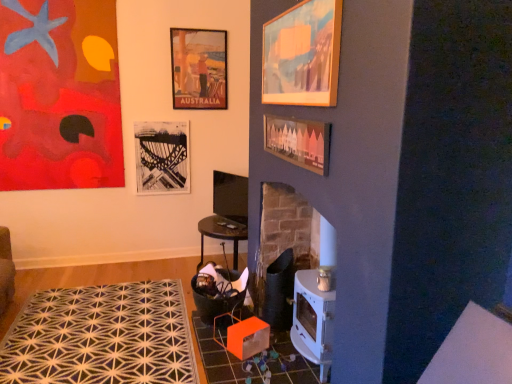
Question: Can you confirm if abstract painting at upper left, the 1th picture frame from the left, is bigger than wooden picture frame at center, the 2th picture frame viewed from the right?

Choices:
 (A) yes
 (B) no

Answer: (A)

Question: Is abstract painting at upper left, which appears as the 5th picture frame when viewed from the right, thinner than wooden picture frame at center, the 2th picture frame viewed from the right?

Choices:
 (A) yes
 (B) no

Answer: (B)

Question: Is abstract painting at upper left, which ranks as the 3th picture frame in back-to-front order, located outside wooden picture frame at center, positioned as the second picture frame in front-to-back order?

Choices:
 (A) no
 (B) yes

Answer: (B)

Question: Is abstract painting at upper left, which appears as the 5th picture frame when viewed from the right, closer to the viewer compared to wooden picture frame at center, the fourth picture frame viewed from the back?

Choices:
 (A) no
 (B) yes

Answer: (A)

Question: Is abstract painting at upper left, which ranks as the 3th picture frame in back-to-front order, directly adjacent to wooden picture frame at center, positioned as the second picture frame in front-to-back order?

Choices:
 (A) yes
 (B) no

Answer: (B)

Question: Is orange fabric rocking chair at lower left inside the boundaries of wooden picture frame at center, acting as the 4th picture frame starting from the left, or outside?

Choices:
 (A) inside
 (B) outside

Answer: (B)

Question: Looking at their shapes, would you say orange fabric rocking chair at lower left is wider or thinner than wooden picture frame at center, the 2th picture frame viewed from the right?

Choices:
 (A) wide
 (B) thin

Answer: (A)

Question: Visually, is orange fabric rocking chair at lower left positioned to the left or to the right of wooden picture frame at center, positioned as the second picture frame in front-to-back order?

Choices:
 (A) left
 (B) right

Answer: (A)

Question: From a real-world perspective, is orange fabric rocking chair at lower left physically located above or below wooden picture frame at center, the 2th picture frame viewed from the right?

Choices:
 (A) below
 (B) above

Answer: (A)

Question: From their relative heights in the image, would you say black paper picture frame at upper center, the fourth picture frame when ordered from right to left, is taller or shorter than matte paper poster at upper center, marked as the third picture frame in a left-to-right arrangement?

Choices:
 (A) tall
 (B) short

Answer: (B)

Question: Is point tap(162, 183) closer or farther from the camera than point tap(174, 38)?

Choices:
 (A) farther
 (B) closer

Answer: (A)

Question: Would you say black paper picture frame at upper center, which is the 5th picture frame from front to back, is inside or outside matte paper poster at upper center, marked as the third picture frame in a left-to-right arrangement?

Choices:
 (A) inside
 (B) outside

Answer: (B)

Question: From a real-world perspective, is black paper picture frame at upper center, which is counted as the 2th picture frame, starting from the left, above or below matte paper poster at upper center, which ranks as the 2th picture frame in back-to-front order?

Choices:
 (A) above
 (B) below

Answer: (B)

Question: Is black paper picture frame at upper center, which is counted as the 2th picture frame, starting from the left, spatially inside orange fabric rocking chair at lower left, or outside of it?

Choices:
 (A) outside
 (B) inside

Answer: (A)

Question: In terms of size, does black paper picture frame at upper center, the 1th picture frame when ordered from back to front, appear bigger or smaller than orange fabric rocking chair at lower left?

Choices:
 (A) small
 (B) big

Answer: (A)